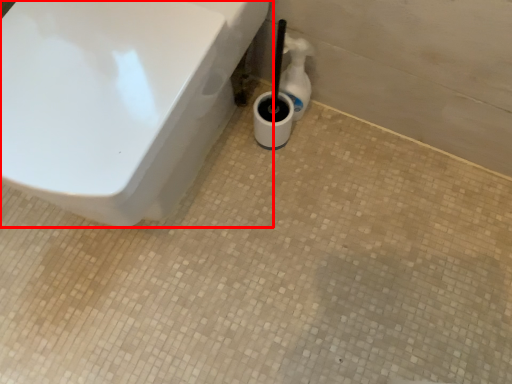
Question: In this image, where is toilet (annotated by the red box) located relative to bottle?

Choices:
 (A) left
 (B) right

Answer: (A)